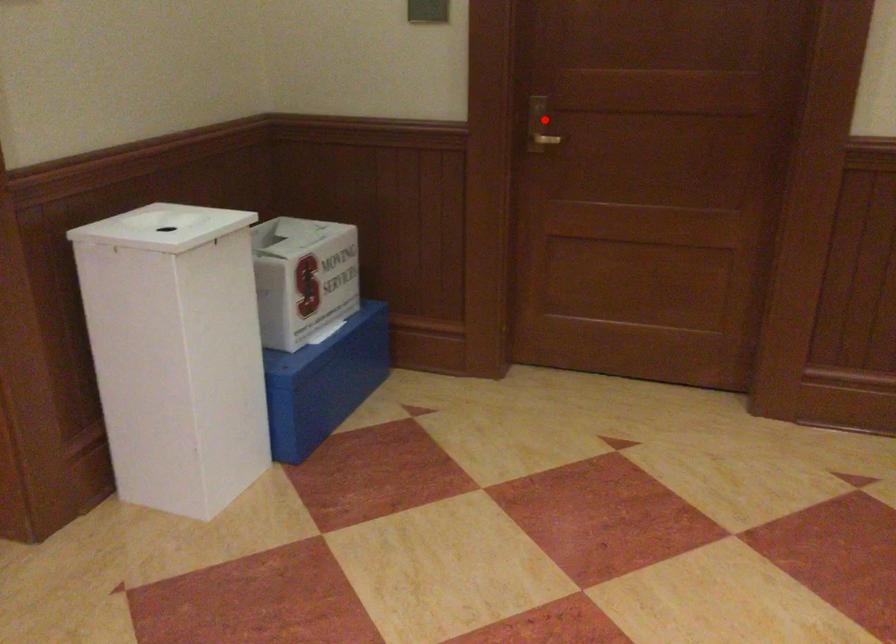
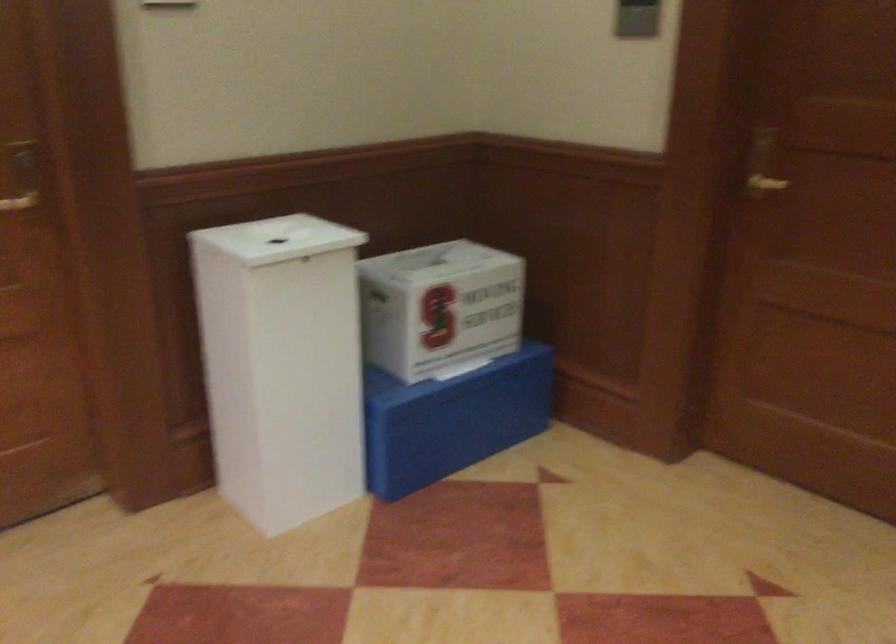
Question: I am providing you with two images of the same scene from different viewpoints. Given a red point in image1, look at the same physical point in image2. Is it:

Choices:
 (A) Closer to the viewpoint
 (B) Farther from the viewpoint

Answer: (A)